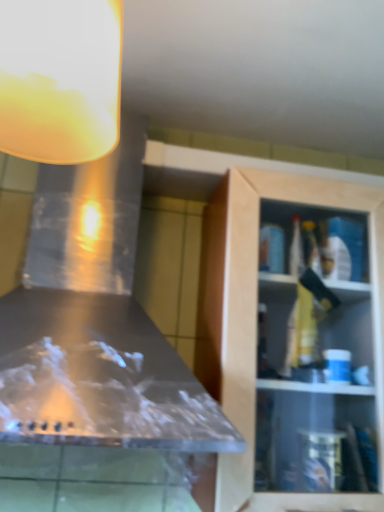
Question: Looking at the image, does translucent glass lampshade at upper left seem bigger or smaller compared to wooden cabinet at right?

Choices:
 (A) small
 (B) big

Answer: (A)

Question: Considering their positions, is translucent glass lampshade at upper left located in front of or behind wooden cabinet at right?

Choices:
 (A) behind
 (B) front

Answer: (B)

Question: Based on their positions, is translucent glass lampshade at upper left located to the left or right of wooden cabinet at right?

Choices:
 (A) right
 (B) left

Answer: (B)

Question: Considering their positions, is wooden cabinet at right located in front of or behind translucent glass lampshade at upper left?

Choices:
 (A) behind
 (B) front

Answer: (A)

Question: Would you say wooden cabinet at right is to the left or to the right of translucent glass lampshade at upper left in the picture?

Choices:
 (A) left
 (B) right

Answer: (B)

Question: Based on their sizes in the image, would you say wooden cabinet at right is bigger or smaller than translucent glass lampshade at upper left?

Choices:
 (A) big
 (B) small

Answer: (A)

Question: Considering the positions of wooden cabinet at right and translucent glass lampshade at upper left in the image, is wooden cabinet at right wider or thinner than translucent glass lampshade at upper left?

Choices:
 (A) wide
 (B) thin

Answer: (A)